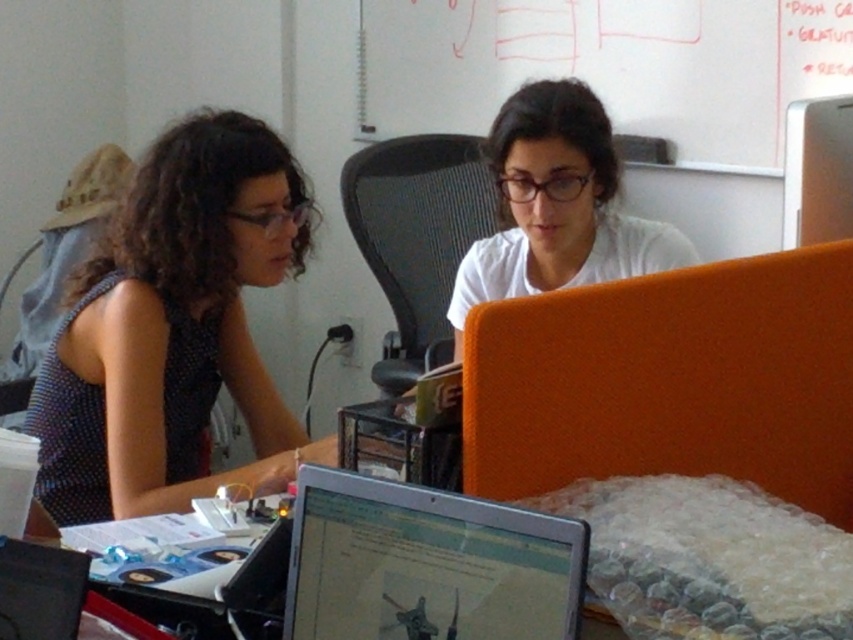
Can you confirm if silver metallic laptop at center is positioned to the left of white matte shirt at center?

Correct, you'll find silver metallic laptop at center to the left of white matte shirt at center.

Does point (370, 611) come behind point (573, 164)?

That is False.

Is point (376, 634) positioned after point (628, 259)?

No.

The height and width of the screenshot is (640, 853). Find the location of `silver metallic laptop at center`. silver metallic laptop at center is located at coordinates (426, 564).

Does point (653, 506) lie in front of point (461, 269)?

Yes, it is.

Can you confirm if metallic silver laptop at lower center is taller than white matte shirt at center?

No, metallic silver laptop at lower center is not taller than white matte shirt at center.

Who is more distant from viewer, (761, 573) or (607, 124)?

Positioned behind is point (607, 124).

You are a GUI agent. You are given a task and a screenshot of the screen. Output one action in this format:
    pyautogui.click(x=<x>, y=<y>)
    Task: Click on the metallic silver laptop at lower center
    The width and height of the screenshot is (853, 640).
    Given the screenshot: What is the action you would take?
    pyautogui.click(x=711, y=557)

Which is behind, point (657, 586) or point (10, 547)?

The point (657, 586) is behind.

Does metallic silver laptop at lower center have a greater height compared to matte black laptop at lower left?

Yes.

Is point (268, 541) closer to viewer compared to point (65, 636)?

No, it is behind (65, 636).

This screenshot has height=640, width=853. In order to click on metallic silver laptop at lower center in this screenshot , I will do `click(711, 557)`.